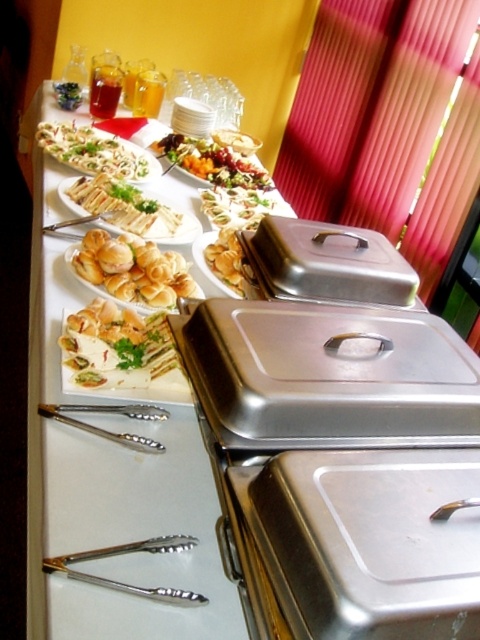
You are a guest at the buffet and want to compare the sizes of the golden brown bread at center and the green leafy vegetable at upper left. Which one is larger?

The golden brown bread at center is bigger than the green leafy vegetable at upper left.

You are standing at the buffet table and want to reach both the point at coordinates (256,176) and the point at coordinates (70,100). Which point will you reach first?

You will reach point (256,176) first because it is closer to you than point (70,100).